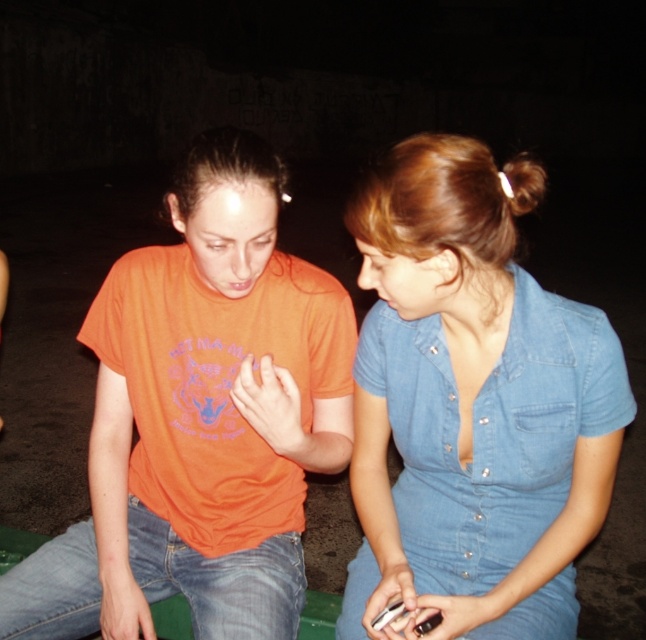
Question: Which point appears closest to the camera in this image?

Choices:
 (A) (359, 440)
 (B) (63, 618)

Answer: (B)

Question: Is orange cotton shirt at center to the left of denim dress at center from the viewer's perspective?

Choices:
 (A) no
 (B) yes

Answer: (B)

Question: Is orange cotton shirt at center thinner than denim dress at center?

Choices:
 (A) yes
 (B) no

Answer: (B)

Question: Is orange cotton shirt at center further to the viewer compared to denim dress at center?

Choices:
 (A) no
 (B) yes

Answer: (B)